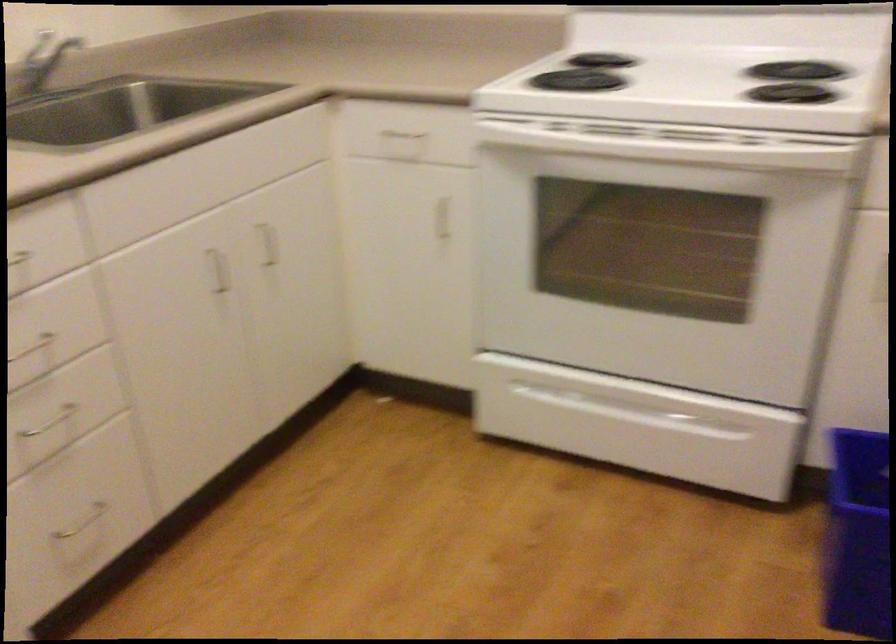
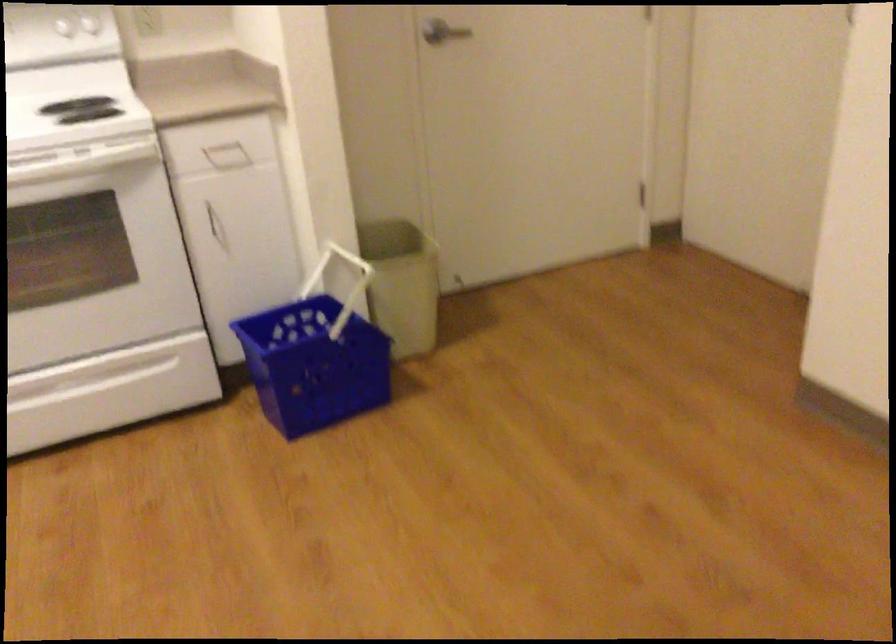
Question: The first image is from the beginning of the video and the second image is from the end. How did the camera likely rotate when shooting the video?

Choices:
 (A) Left
 (B) Right
 (C) Up
 (D) Down

Answer: (B)